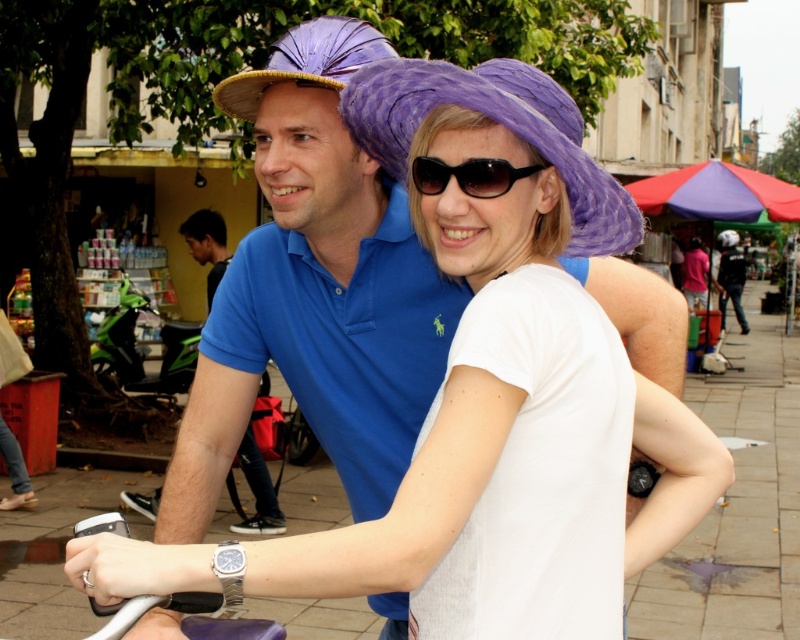
Identify the location of purple paper hat at center. Image resolution: width=800 pixels, height=640 pixels. (500, 124).

Is purple paper hat at center shorter than purple woven hat at upper center?

No.

Who is more distant from viewer, (592,237) or (320,36)?

The point (320,36) is behind.

What are the coordinates of `purple paper hat at center` in the screenshot? It's located at (500, 124).

Is point (333, 83) in front of point (214, 252)?

Yes.

Is the position of purple woven hat at upper center less distant than that of blue cotton polo shirt at center?

Yes, it is.

Measure the distance between purple woven hat at upper center and camera.

purple woven hat at upper center and camera are 6.03 feet apart.

This screenshot has width=800, height=640. In order to click on purple woven hat at upper center in this screenshot , I will do `click(306, 61)`.

Is white matte helmet at upper right positioned at the back of white matte hat at upper center?

No, it is in front of white matte hat at upper center.

Between white matte helmet at upper right and white matte hat at upper center, which one is positioned higher?

white matte hat at upper center is higher up.

You are a GUI agent. You are given a task and a screenshot of the screen. Output one action in this format:
    pyautogui.click(x=<x>, y=<y>)
    Task: Click on the white matte helmet at upper right
    Image resolution: width=800 pixels, height=640 pixels.
    Given the screenshot: What is the action you would take?
    pyautogui.click(x=730, y=276)

Locate an element on the screen. white matte helmet at upper right is located at coordinates (730, 276).